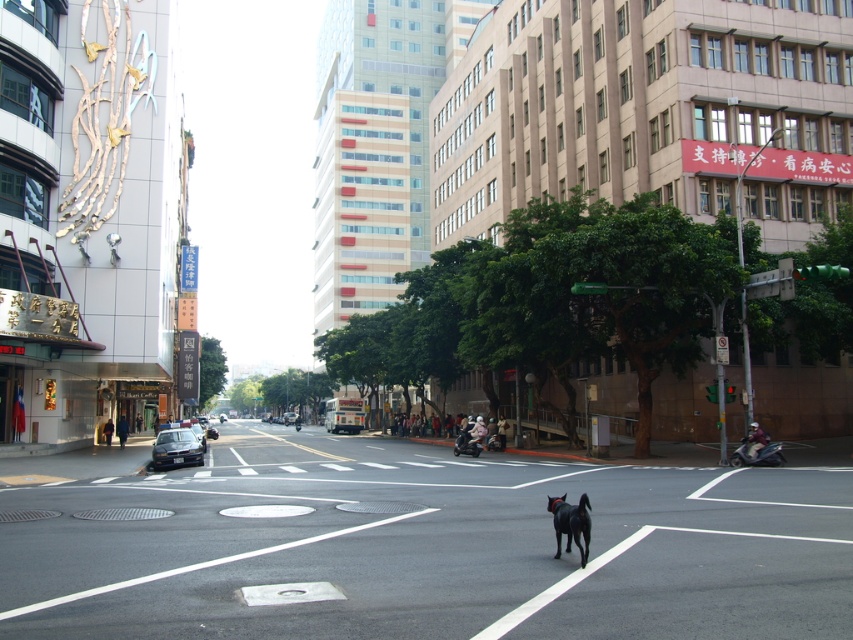
You are a delivery person on a bicycle, and you need to pass between the black asphalt road at center and the black glossy dog at center. Which direction should you steer your bicycle to avoid hitting the dog?

The black asphalt road at center is to the left of the black glossy dog at center, so you should steer your bicycle to the right to avoid hitting the dog.